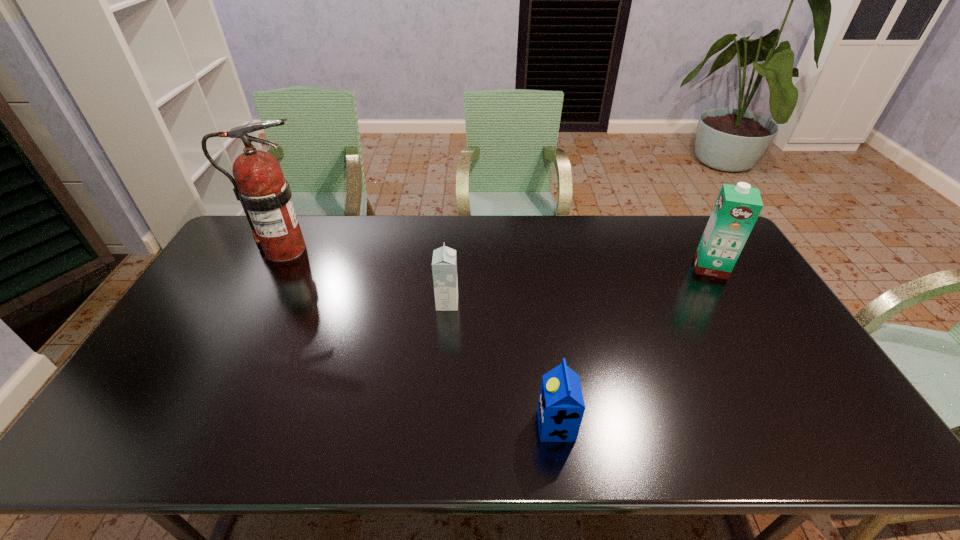
Where is `empty location between the second tallest object and the third object from left to right`? empty location between the second tallest object and the third object from left to right is located at coordinates (634, 346).

Identify the location of blank region between the rightmost object and the tallest object. This screenshot has height=540, width=960. (497, 258).

At what (x,y) coordinates should I click in order to perform the action: click on object identified as the second closest to the fire extinguisher. Please return your answer as a coordinate pair (x, y). Looking at the image, I should click on (561, 407).

Select which object appears as the closest to the tallest object. Please provide its 2D coordinates. Your answer should be formatted as a tuple, i.e. [(x, y)], where the tuple contains the x and y coordinates of a point satisfying the conditions above.

[(444, 262)]

Select which carton appears as the second closest to the tallest carton. Please provide its 2D coordinates. Your answer should be formatted as a tuple, i.e. [(x, y)], where the tuple contains the x and y coordinates of a point satisfying the conditions above.

[(444, 262)]

Identify which carton is located as the nearest to the second farthest carton. Please provide its 2D coordinates. Your answer should be formatted as a tuple, i.e. [(x, y)], where the tuple contains the x and y coordinates of a point satisfying the conditions above.

[(561, 407)]

Identify the location of vacant region that satisfies the following two spatial constraints: 1. on the front side of the second tallest object; 2. on the front label of the third object from right to left. (732, 303).

The image size is (960, 540). What are the coordinates of `free spot that satisfies the following two spatial constraints: 1. at the nozzle of the leftmost object; 2. on the right side of the rightmost carton` in the screenshot? It's located at (276, 267).

Where is `blank space that satisfies the following two spatial constraints: 1. at the nozzle of the tallest object; 2. on the back side of the rightmost object`? blank space that satisfies the following two spatial constraints: 1. at the nozzle of the tallest object; 2. on the back side of the rightmost object is located at coordinates (276, 267).

Identify the location of free space that satisfies the following two spatial constraints: 1. at the nozzle of the fire extinguisher; 2. on the back side of the second tallest object. The image size is (960, 540). (276, 267).